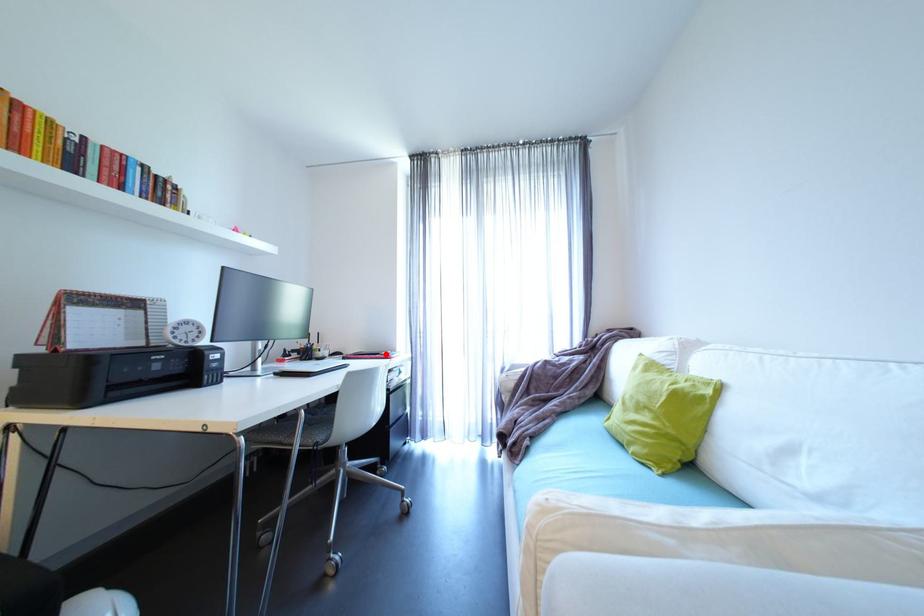
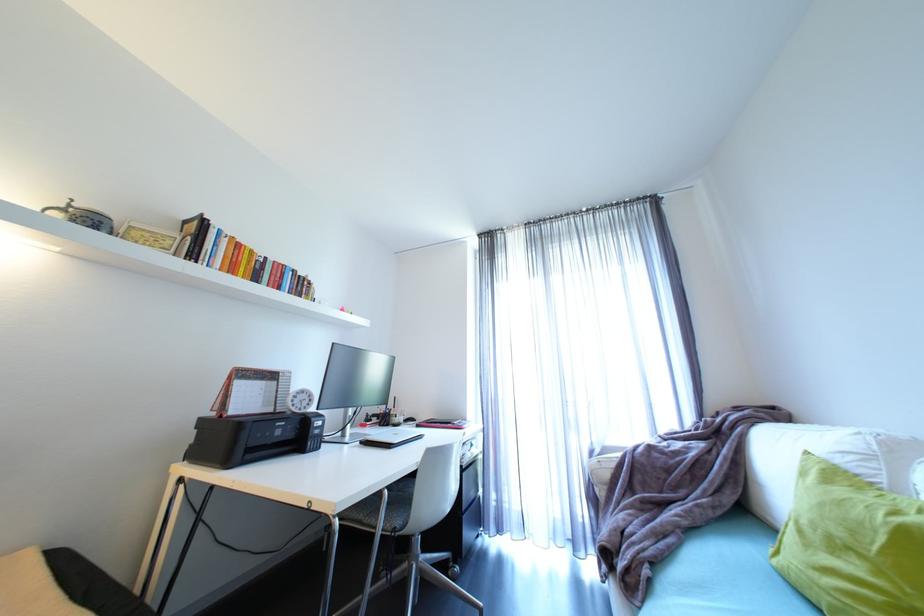
The point at the highlighted location is marked in the first image. Where is the corresponding point in the second image?

(457, 424)